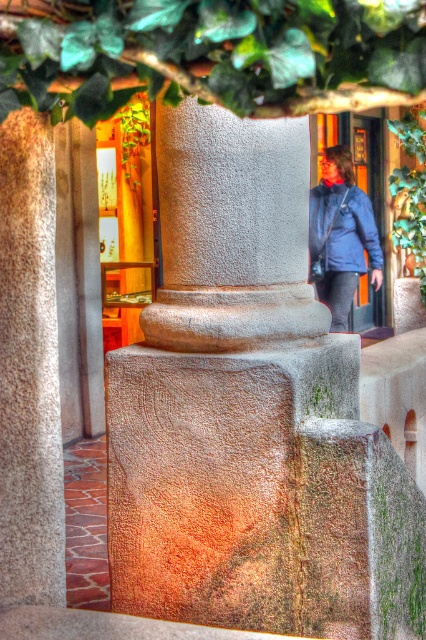
You are standing in the entrance of the shop and see the green leafy tree at upper center and the blue matte jacket at upper right. Which object is taller?

The blue matte jacket at upper right is taller than the green leafy tree at upper center.